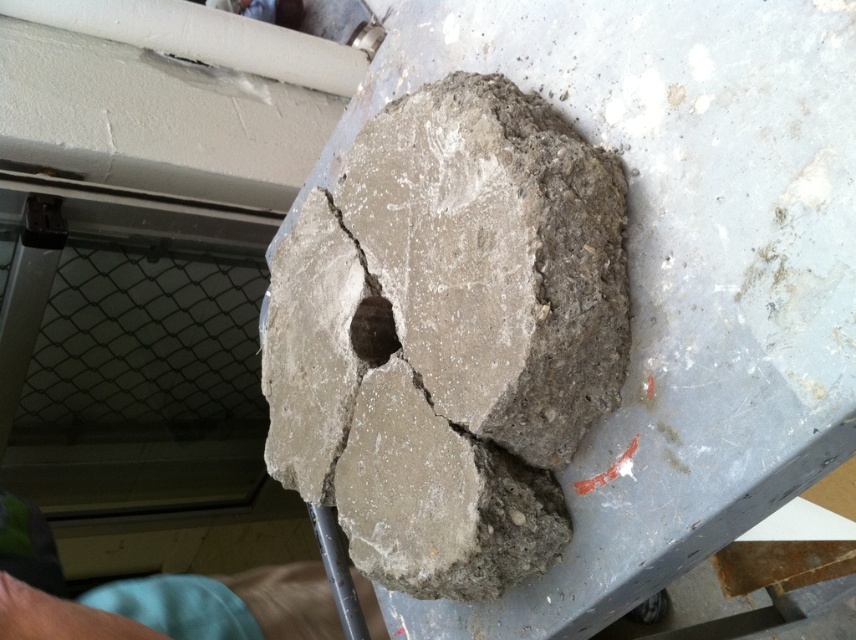
Measure the distance between gray concrete at center and camera.

37.40 inches

Who is more forward, (693, 24) or (366, 358)?

Point (693, 24)

Does point (777, 193) come farther from viewer compared to point (383, 352)?

No, (777, 193) is closer to viewer.

The width and height of the screenshot is (856, 640). Find the location of `gray concrete at center`. gray concrete at center is located at coordinates (673, 272).

Is gray concrete at center wider than skinny blue shorts at lower left?

Yes.

Which is more to the left, gray concrete at center or skinny blue shorts at lower left?

skinny blue shorts at lower left is more to the left.

Is point (645, 369) positioned in front of point (80, 611)?

Yes, it is in front of point (80, 611).

Where is `gray concrete at center`? gray concrete at center is located at coordinates (673, 272).

Can you confirm if skinny blue shorts at lower left is bigger than dark gray concrete hole at center?

Correct, skinny blue shorts at lower left is larger in size than dark gray concrete hole at center.

Does skinny blue shorts at lower left have a smaller size compared to dark gray concrete hole at center?

Actually, skinny blue shorts at lower left might be larger than dark gray concrete hole at center.

Find the location of a particular element. skinny blue shorts at lower left is located at coordinates (288, 600).

Locate an element on the screen. skinny blue shorts at lower left is located at coordinates (288, 600).